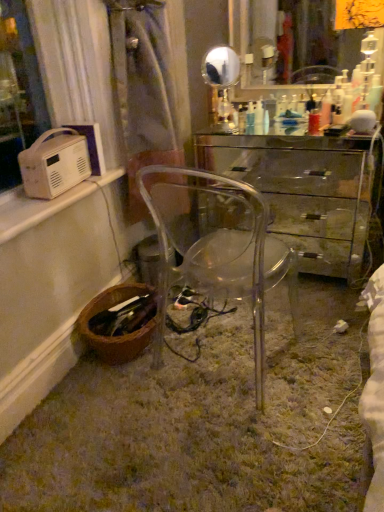
Where is `free space in front of white plastic radio at left, the second appliance from the back`? The height and width of the screenshot is (512, 384). free space in front of white plastic radio at left, the second appliance from the back is located at coordinates (38, 208).